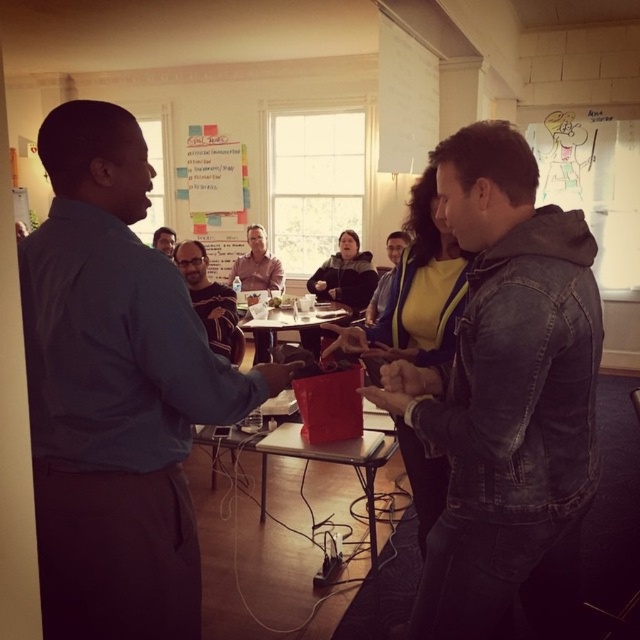
Question: Among these objects, which one is nearest to the camera?

Choices:
 (A) matte black shirt at center
 (B) white paper at upper center

Answer: (A)

Question: Does metallic silver table at center have a smaller size compared to matte black shirt at center?

Choices:
 (A) yes
 (B) no

Answer: (B)

Question: Is metallic silver table at center thinner than matte black shirt at center?

Choices:
 (A) yes
 (B) no

Answer: (A)

Question: In this image, where is denim jacket at lower right located relative to metallic silver table at center?

Choices:
 (A) left
 (B) right

Answer: (B)

Question: Estimate the real-world distances between objects in this image. Which object is farther from the metallic silver table at center?

Choices:
 (A) dark brown sweater at center
 (B) denim jacket at lower right
 (C) white paper at upper center

Answer: (C)

Question: Which of these objects is positioned farthest from the denim jacket at center?

Choices:
 (A) dark brown sweater at center
 (B) blue shirt at left
 (C) matte black shirt at center
 (D) denim jacket at lower right

Answer: (B)